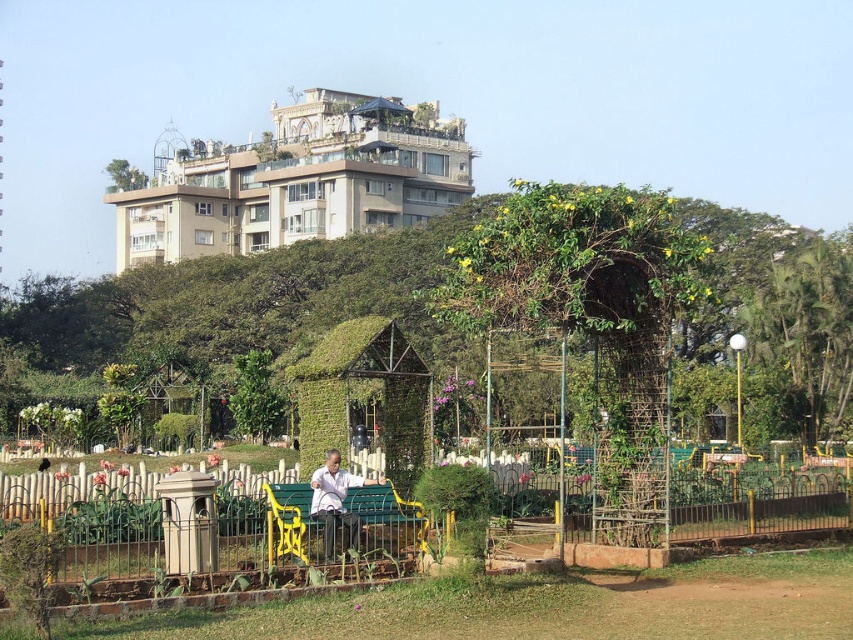
You are planning to place a large potted plant between the green leafy arch at center and the white fabric bench at center. Given their sizes, which object should the potted plant be closer to?

The green leafy arch at center is larger in size than the white fabric bench at center, so the potted plant should be placed closer to the white fabric bench at center to maintain balance.

Consider the image. You are standing at the point labeled as point (242, 304) in the park. What is the nearest object to you?

The nearest object to you is the green ivy covered structure at center, as point (242, 304) is on it.

You are planning to hang a large banner that requires at least 3 meters of vertical space. Looking at the green leafy arch at center and the green painted wood bench at center, which object would be suitable for hanging the banner based on their height?

The green leafy arch at center is much taller than the green painted wood bench at center, so it would be suitable for hanging the banner requiring at least 3 meters of vertical space.